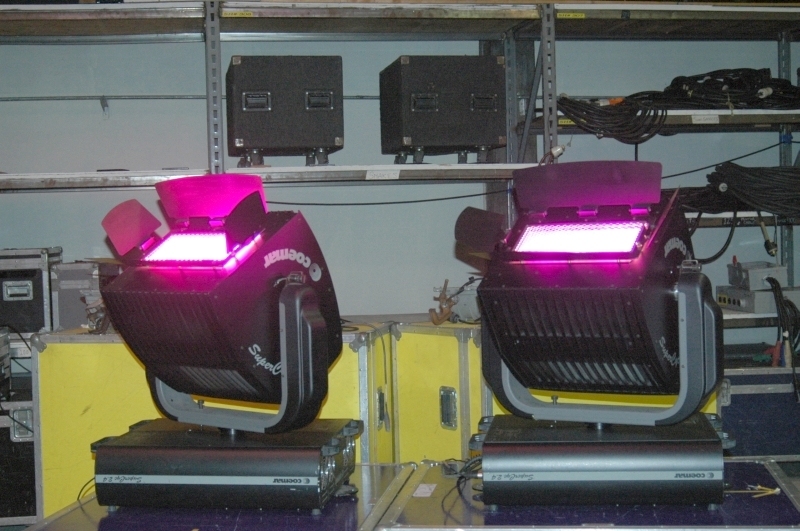
The image size is (800, 531). Find the location of `wall`. wall is located at coordinates (390, 221).